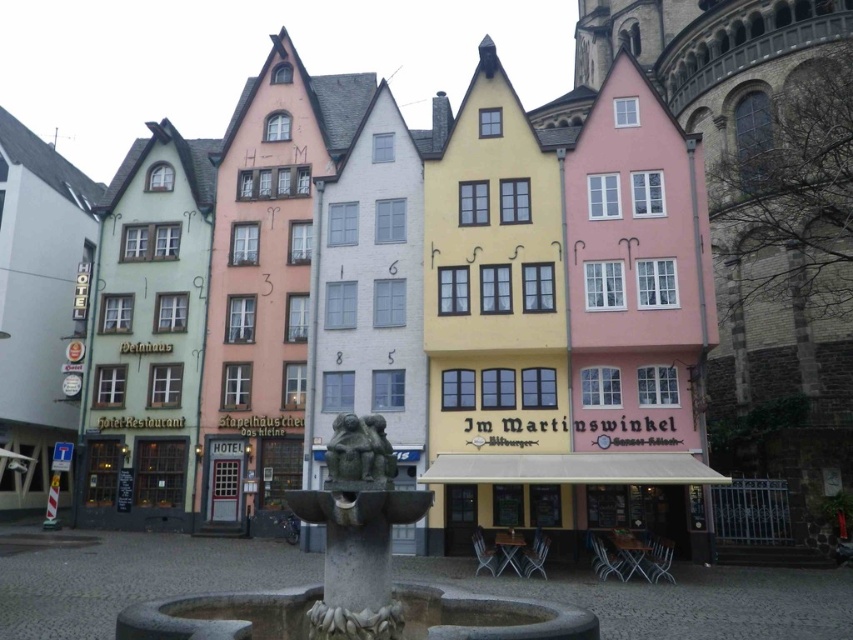
From the picture: Which is below, granite fountain at center or green stone statue at center?

granite fountain at center is lower down.

Between point (352, 483) and point (364, 458), which one is positioned in front?

Point (352, 483)

Describe the element at coordinates (355, 572) in the screenshot. I see `granite fountain at center` at that location.

Identify the location of granite fountain at center. The height and width of the screenshot is (640, 853). (355, 572).